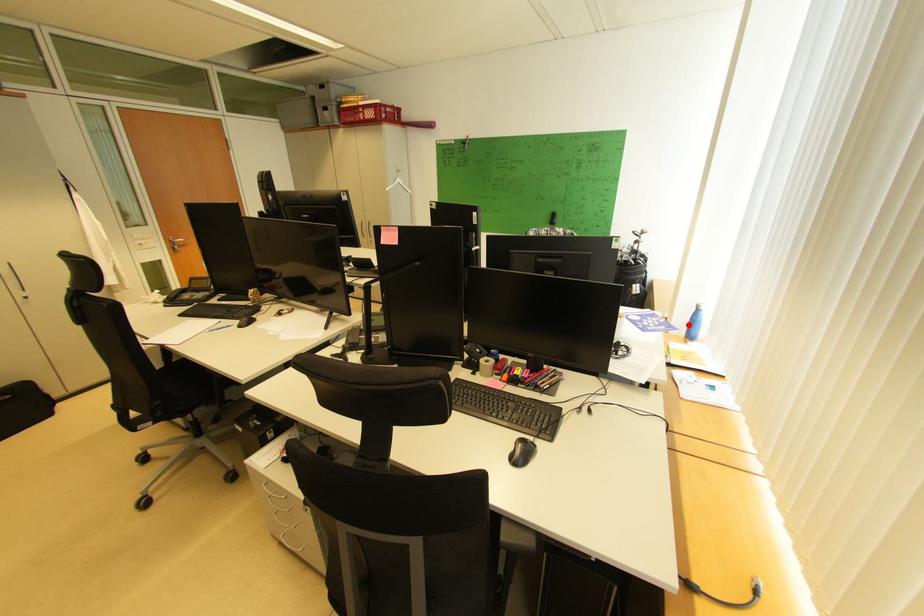
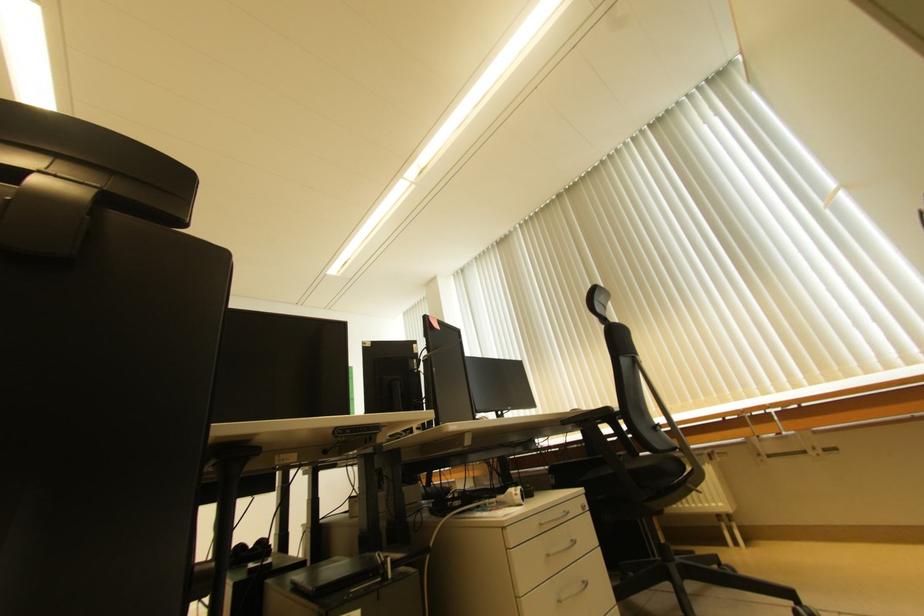
Question: I am providing you with two images of the same scene from different viewpoints. A red point is marked on the first image. Is the red point's position out of view in image 2?

Choices:
 (A) Yes
 (B) No

Answer: (A)